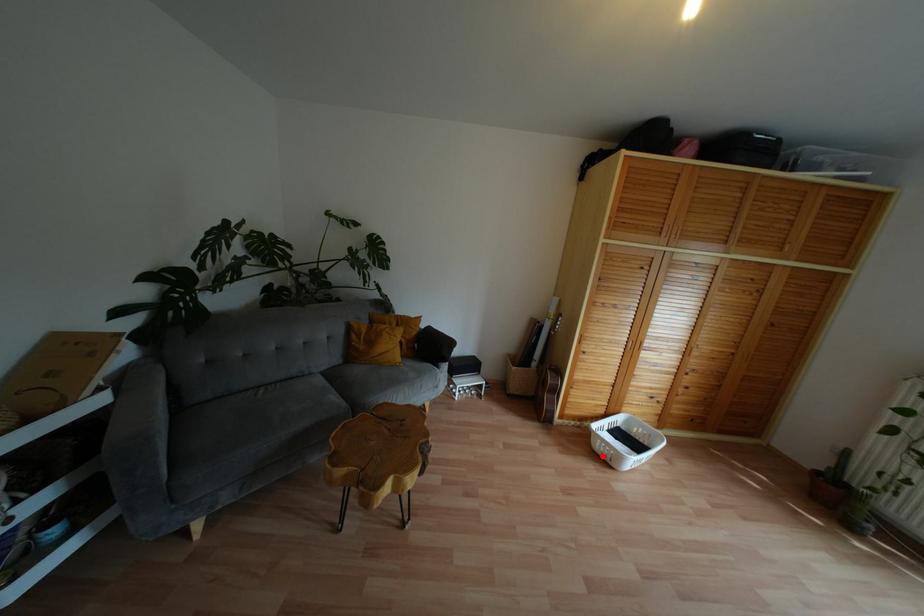
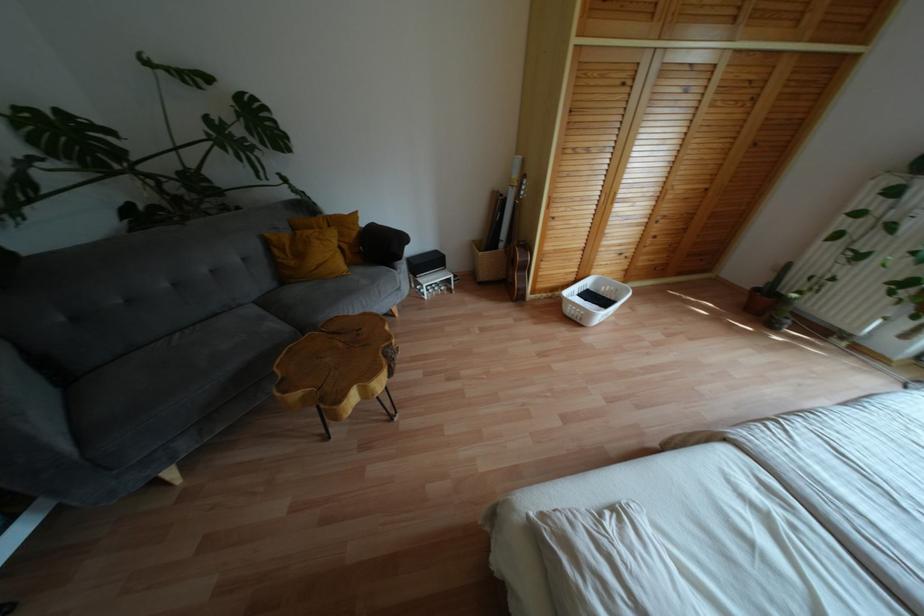
Question: I am providing you with two images of the same scene from different viewpoints. Given a red point in image1, look at the same physical point in image2. Is it:

Choices:
 (A) Closer to the viewpoint
 (B) Farther from the viewpoint

Answer: (B)